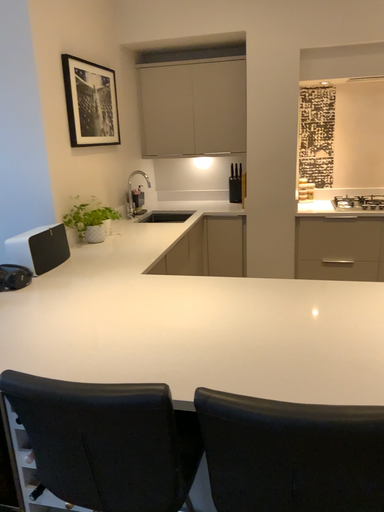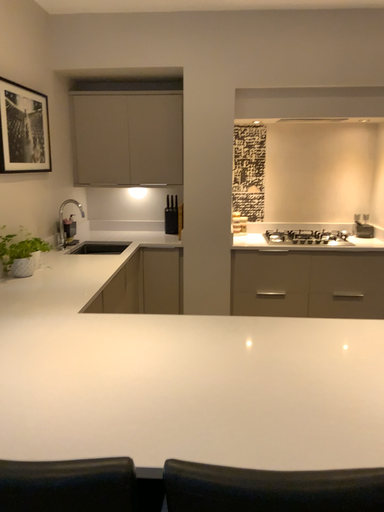
Question: How did the camera likely rotate when shooting the video?

Choices:
 (A) rotated left
 (B) rotated right

Answer: (B)